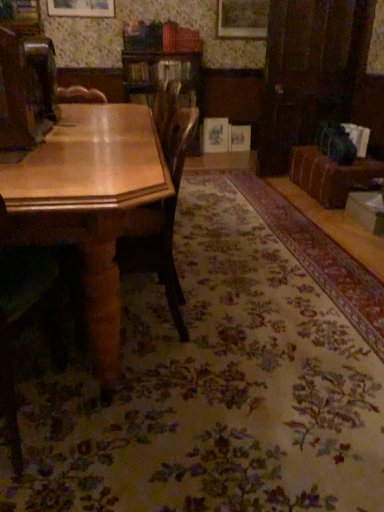
Where is `free space in front of wooden chair at center, marked as the 1th chair in a right-to-left arrangement`? This screenshot has height=512, width=384. free space in front of wooden chair at center, marked as the 1th chair in a right-to-left arrangement is located at coordinates (167, 385).